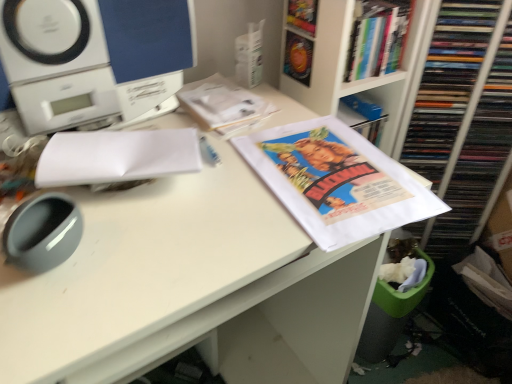
You are a GUI agent. You are given a task and a screenshot of the screen. Output one action in this format:
    pyautogui.click(x=<x>, y=<y>)
    Task: Click on the free space that is to the left of matte paper poster at center
    
    Given the screenshot: What is the action you would take?
    pyautogui.click(x=193, y=207)